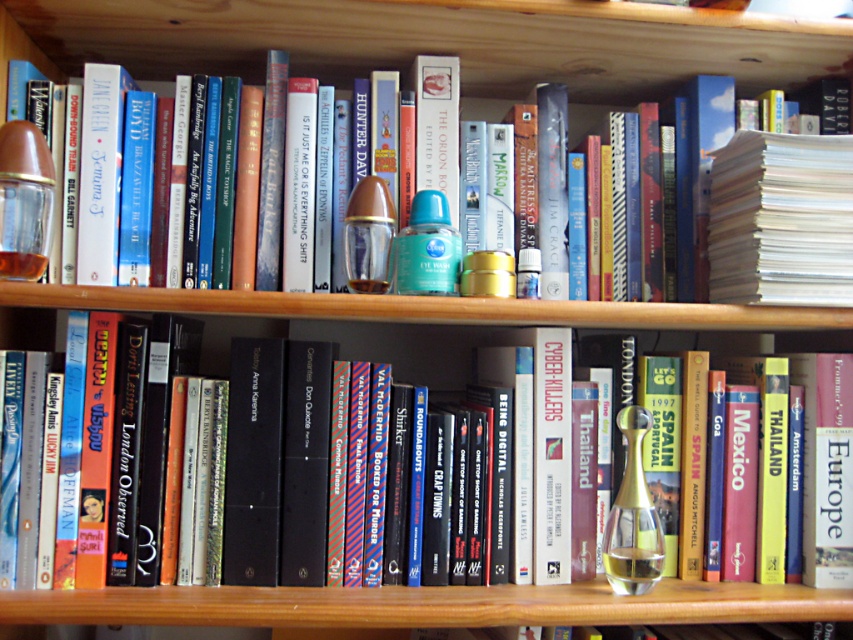
Question: In this image, where is hardcover book at center located relative to matte glass perfume at left?

Choices:
 (A) right
 (B) left

Answer: (B)

Question: Which point is farther to the camera?

Choices:
 (A) (704, 346)
 (B) (105, 301)

Answer: (A)

Question: Can you confirm if hardcover book at center is bigger than matte glass perfume at left?

Choices:
 (A) no
 (B) yes

Answer: (B)

Question: Is hardcover book at center above matte glass perfume at left?

Choices:
 (A) yes
 (B) no

Answer: (B)